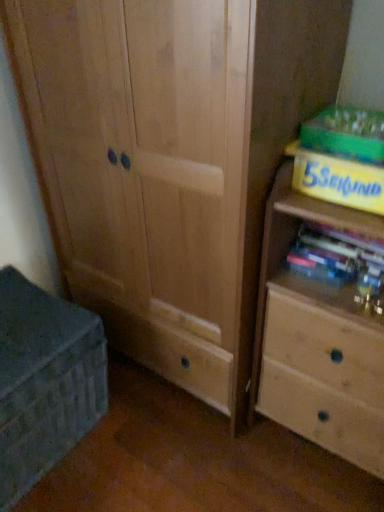
Identify the location of yellow cardboard book at upper right, which is the 2th paperback book from bottom to top. Image resolution: width=384 pixels, height=512 pixels. (346, 134).

Measure the distance between yellow matte paperback book at upper right, which ranks as the 1th paperback book in bottom-to-top order, and camera.

35.91 inches.

This screenshot has height=512, width=384. What do you see at coordinates (338, 180) in the screenshot?
I see `yellow matte paperback book at upper right, which is the second paperback book in top-to-bottom order` at bounding box center [338, 180].

Describe the element at coordinates (338, 258) in the screenshot. I see `matte plastic books at right` at that location.

The width and height of the screenshot is (384, 512). What do you see at coordinates (317, 339) in the screenshot? I see `light wood chest of drawers at right` at bounding box center [317, 339].

Find the location of a particular element. The height and width of the screenshot is (512, 384). matte gray chest at lower left is located at coordinates (44, 381).

Identify the location of yellow cardboard book at upper right, which is the 2th paperback book from bottom to top. The width and height of the screenshot is (384, 512). (346, 134).

Is matte gray chest at lower left taller or shorter than yellow matte paperback book at upper right, which ranks as the 1th paperback book in bottom-to-top order?

In the image, matte gray chest at lower left appears to be taller than yellow matte paperback book at upper right, which ranks as the 1th paperback book in bottom-to-top order.

How much distance is there between matte gray chest at lower left and yellow matte paperback book at upper right, which ranks as the 1th paperback book in bottom-to-top order?

matte gray chest at lower left and yellow matte paperback book at upper right, which ranks as the 1th paperback book in bottom-to-top order, are 90.91 centimeters apart from each other.

Does point (6, 297) come closer to viewer compared to point (300, 151)?

No, it is behind (300, 151).

Considering the sizes of matte gray chest at lower left and yellow matte paperback book at upper right, which ranks as the 1th paperback book in bottom-to-top order, in the image, is matte gray chest at lower left wider or thinner than yellow matte paperback book at upper right, which ranks as the 1th paperback book in bottom-to-top order,?

matte gray chest at lower left is wider than yellow matte paperback book at upper right, which ranks as the 1th paperback book in bottom-to-top order.

Considering the positions of objects matte gray chest at lower left and light wood chest of drawers at right in the image provided, who is more to the left, matte gray chest at lower left or light wood chest of drawers at right?

Positioned to the left is matte gray chest at lower left.

This screenshot has height=512, width=384. I want to click on cabinetry behind the light wood chest of drawers at right, so click(44, 381).

Is matte gray chest at lower left aimed at light wood chest of drawers at right?

No.

How different are the orientations of matte gray chest at lower left and light wood chest of drawers at right in degrees?

They differ by 88.9 degrees in their facing directions.

Can yellow cardboard book at upper right, the first paperback book when ordered from top to bottom, be found inside matte gray chest at lower left?

That's incorrect, yellow cardboard book at upper right, the first paperback book when ordered from top to bottom, is not inside matte gray chest at lower left.

From a real-world perspective, does matte gray chest at lower left stand above yellow cardboard book at upper right, which is the 2th paperback book from bottom to top?

No, from a real-world perspective, matte gray chest at lower left is not on top of yellow cardboard book at upper right, which is the 2th paperback book from bottom to top.

Which object is closer to the camera, matte gray chest at lower left or yellow cardboard book at upper right, the first paperback book when ordered from top to bottom?

yellow cardboard book at upper right, the first paperback book when ordered from top to bottom, is in front.

Which is closer to the camera, (263, 234) or (331, 111)?

The point (263, 234) is more forward.

Between light wood chest of drawers at right and yellow cardboard book at upper right, which is the 2th paperback book from bottom to top, which one is positioned behind?

yellow cardboard book at upper right, which is the 2th paperback book from bottom to top.

Can you confirm if light wood chest of drawers at right is positioned to the left of yellow cardboard book at upper right, which is the 2th paperback book from bottom to top?

No.

Based on the photo, between light wood chest of drawers at right and yellow cardboard book at upper right, which is the 2th paperback book from bottom to top, which one has smaller width?

Thinner between the two is yellow cardboard book at upper right, which is the 2th paperback book from bottom to top.

Considering the positions of points (378, 403) and (42, 406), is point (378, 403) closer to camera compared to point (42, 406)?

Yes, point (378, 403) is closer to viewer.

Considering the relative sizes of light wood chest of drawers at right and matte gray chest at lower left in the image provided, is light wood chest of drawers at right bigger than matte gray chest at lower left?

Correct, light wood chest of drawers at right is larger in size than matte gray chest at lower left.

Between light wood chest of drawers at right and matte gray chest at lower left, which one appears on the right side from the viewer's perspective?

From the viewer's perspective, light wood chest of drawers at right appears more on the right side.

Is light wood chest of drawers at right beside matte gray chest at lower left?

light wood chest of drawers at right is not next to matte gray chest at lower left, and they're not touching.

From a real-world perspective, is matte plastic books at right above or below light wood chest of drawers at right?

matte plastic books at right is situated higher than light wood chest of drawers at right in the real world.

Is matte plastic books at right completely or partially outside of light wood chest of drawers at right?

Actually, matte plastic books at right is within light wood chest of drawers at right.

How different are the orientations of matte plastic books at right and light wood chest of drawers at right in degrees?

They differ by 0.642 degrees in their facing directions.

Where is `chest of drawers lying on the right of matte plastic books at right`? The image size is (384, 512). chest of drawers lying on the right of matte plastic books at right is located at coordinates (317, 339).

Is yellow matte paperback book at upper right, which is the second paperback book in top-to-bottom order, situated inside matte gray chest at lower left or outside?

yellow matte paperback book at upper right, which is the second paperback book in top-to-bottom order, cannot be found inside matte gray chest at lower left.

Consider the image. Does yellow matte paperback book at upper right, which is the second paperback book in top-to-bottom order, turn towards matte gray chest at lower left?

No, yellow matte paperback book at upper right, which is the second paperback book in top-to-bottom order, is not oriented towards matte gray chest at lower left.

In the scene shown: Is yellow matte paperback book at upper right, which is the second paperback book in top-to-bottom order, thinner than matte gray chest at lower left?

Yes.

Does yellow matte paperback book at upper right, which ranks as the 1th paperback book in bottom-to-top order, have a greater height compared to matte gray chest at lower left?

No.

In order to click on cabinetry located below the yellow matte paperback book at upper right, which ranks as the 1th paperback book in bottom-to-top order (from the image's perspective) in this screenshot , I will do `click(44, 381)`.

I want to click on the chest of drawers that appears in front of the matte gray chest at lower left, so click(317, 339).

Looking at the image, which one is located further to matte gray chest at lower left, matte plastic books at right or yellow matte paperback book at upper right, which ranks as the 1th paperback book in bottom-to-top order?

The object further to matte gray chest at lower left is yellow matte paperback book at upper right, which ranks as the 1th paperback book in bottom-to-top order.

Which object lies nearer to the anchor point matte gray chest at lower left, light wood chest of drawers at right or yellow cardboard book at upper right, which is the 2th paperback book from bottom to top?

light wood chest of drawers at right.

Looking at the image, which one is located further to matte gray chest at lower left, yellow cardboard book at upper right, the first paperback book when ordered from top to bottom, or light wood chest of drawers at right?

Among the two, yellow cardboard book at upper right, the first paperback book when ordered from top to bottom, is located further to matte gray chest at lower left.

Looking at the image, which one is located closer to light wood chest of drawers at right, matte gray chest at lower left or yellow cardboard book at upper right, which is the 2th paperback book from bottom to top?

yellow cardboard book at upper right, which is the 2th paperback book from bottom to top, is positioned closer to the anchor light wood chest of drawers at right.

Based on their spatial positions, is matte gray chest at lower left or light wood chest of drawers at right further from yellow cardboard book at upper right, which is the 2th paperback book from bottom to top?

matte gray chest at lower left is positioned further to the anchor yellow cardboard book at upper right, which is the 2th paperback book from bottom to top.

Consider the image. Estimate the real-world distances between objects in this image. Which object is further from matte plastic books at right, yellow matte paperback book at upper right, which ranks as the 1th paperback book in bottom-to-top order, or yellow cardboard book at upper right, the first paperback book when ordered from top to bottom?

Among the two, yellow cardboard book at upper right, the first paperback book when ordered from top to bottom, is located further to matte plastic books at right.

Looking at the image, which one is located further to matte plastic books at right, yellow cardboard book at upper right, which is the 2th paperback book from bottom to top, or yellow matte paperback book at upper right, which ranks as the 1th paperback book in bottom-to-top order?

Among the two, yellow cardboard book at upper right, which is the 2th paperback book from bottom to top, is located further to matte plastic books at right.

Based on their spatial positions, is matte plastic books at right or light wood chest of drawers at right further from yellow cardboard book at upper right, the first paperback book when ordered from top to bottom?

Based on the image, light wood chest of drawers at right appears to be further to yellow cardboard book at upper right, the first paperback book when ordered from top to bottom.

Identify the location of book situated between matte gray chest at lower left and light wood chest of drawers at right from left to right. The width and height of the screenshot is (384, 512). 338,258.

I want to click on paperback book that lies between yellow cardboard book at upper right, which is the 2th paperback book from bottom to top, and matte plastic books at right from top to bottom, so click(x=338, y=180).

This screenshot has height=512, width=384. Find the location of `book situated between matte gray chest at lower left and yellow matte paperback book at upper right, which ranks as the 1th paperback book in bottom-to-top order, from left to right`. book situated between matte gray chest at lower left and yellow matte paperback book at upper right, which ranks as the 1th paperback book in bottom-to-top order, from left to right is located at coordinates (338, 258).

Identify the location of paperback book between yellow cardboard book at upper right, the first paperback book when ordered from top to bottom, and light wood chest of drawers at right, in the vertical direction. (338, 180).